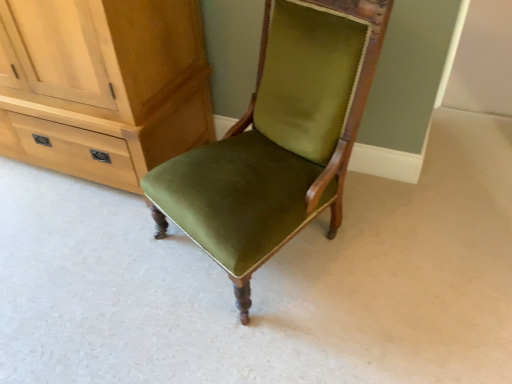
Find the location of a particular element. Image resolution: width=512 pixels, height=384 pixels. matte wood cabinet at left is located at coordinates (103, 85).

What do you see at coordinates (103, 85) in the screenshot?
I see `matte wood cabinet at left` at bounding box center [103, 85].

In order to click on velvet green chair at center in this screenshot , I will do `click(277, 140)`.

What do you see at coordinates (277, 140) in the screenshot? I see `velvet green chair at center` at bounding box center [277, 140].

Where is `matte wood cabinet at left`? matte wood cabinet at left is located at coordinates (103, 85).

In the scene shown: Considering the positions of objects matte wood cabinet at left and velvet green chair at center in the image provided, who is more to the left, matte wood cabinet at left or velvet green chair at center?

Positioned to the left is matte wood cabinet at left.

Is the position of matte wood cabinet at left less distant than that of velvet green chair at center?

No, it is behind velvet green chair at center.

Which is less distant, (189, 25) or (290, 83)?

The point (290, 83) is in front.

From the image's perspective, which is above, matte wood cabinet at left or velvet green chair at center?

matte wood cabinet at left is shown above in the image.

From a real-world perspective, which is physically below, matte wood cabinet at left or velvet green chair at center?

matte wood cabinet at left, from a real-world perspective.

Between matte wood cabinet at left and velvet green chair at center, which one has larger width?

Wider between the two is velvet green chair at center.

Which of these two, matte wood cabinet at left or velvet green chair at center, stands taller?

Standing taller between the two is velvet green chair at center.

Which of these two, matte wood cabinet at left or velvet green chair at center, is bigger?

With larger size is matte wood cabinet at left.

Would you say matte wood cabinet at left contains velvet green chair at center?

No, matte wood cabinet at left does not contain velvet green chair at center.

Does matte wood cabinet at left touch velvet green chair at center?

No, matte wood cabinet at left is not beside velvet green chair at center.

Is matte wood cabinet at left aimed at velvet green chair at center?

No, matte wood cabinet at left is not aimed at velvet green chair at center.

This screenshot has width=512, height=384. Find the location of `cabinetry that is under the velvet green chair at center (from a real-world perspective)`. cabinetry that is under the velvet green chair at center (from a real-world perspective) is located at coordinates pyautogui.click(x=103, y=85).

Which object is positioned more to the right, velvet green chair at center or matte wood cabinet at left?

velvet green chair at center.

In the image, is velvet green chair at center positioned in front of or behind matte wood cabinet at left?

velvet green chair at center is positioned closer to the viewer than matte wood cabinet at left.

Does point (173, 201) come closer to viewer compared to point (203, 115)?

Yes, it is.

From the image's perspective, does velvet green chair at center appear lower than matte wood cabinet at left?

Yes, from the image's perspective, velvet green chair at center is below matte wood cabinet at left.

From a real-world perspective, is velvet green chair at center located higher than matte wood cabinet at left?

Correct, in the physical world, velvet green chair at center is higher than matte wood cabinet at left.

Considering the sizes of objects velvet green chair at center and matte wood cabinet at left in the image provided, who is thinner, velvet green chair at center or matte wood cabinet at left?

matte wood cabinet at left is thinner.

Who is taller, velvet green chair at center or matte wood cabinet at left?

Standing taller between the two is velvet green chair at center.

Is velvet green chair at center bigger than matte wood cabinet at left?

Actually, velvet green chair at center might be smaller than matte wood cabinet at left.

Do you think velvet green chair at center is within matte wood cabinet at left, or outside of it?

velvet green chair at center cannot be found inside matte wood cabinet at left.

Would you say velvet green chair at center is a long distance from matte wood cabinet at left?

No, velvet green chair at center is not far from matte wood cabinet at left.

Is velvet green chair at center oriented away from matte wood cabinet at left?

No, velvet green chair at center is not facing the opposite direction of matte wood cabinet at left.

Find the location of a particular element. The width and height of the screenshot is (512, 384). cabinetry above the velvet green chair at center (from the image's perspective) is located at coordinates (103, 85).

This screenshot has height=384, width=512. I want to click on cabinetry directly beneath the velvet green chair at center (from a real-world perspective), so click(x=103, y=85).

Where is `cabinetry on the left side of velvet green chair at center`? This screenshot has width=512, height=384. cabinetry on the left side of velvet green chair at center is located at coordinates (103, 85).